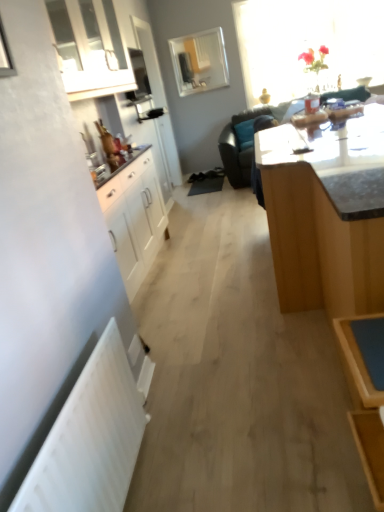
Question: In terms of width, does white matte radiator at lower left look wider or thinner when compared to black leather couch at upper center?

Choices:
 (A) thin
 (B) wide

Answer: (A)

Question: In the image, is white matte radiator at lower left positioned in front of or behind black leather couch at upper center?

Choices:
 (A) behind
 (B) front

Answer: (B)

Question: Estimate the real-world distances between objects in this image. Which object is farther from the translucent glass vase at upper right, marked as the first window in a right-to-left arrangement?

Choices:
 (A) black leather couch at upper center
 (B) white glossy cabinet at upper left
 (C) white matte radiator at lower left
 (D) clear glass mirror at upper center, the first window positioned from the left
 (E) light brown wooden table at center

Answer: (C)

Question: Based on their relative distances, which object is nearer to the black leather couch at upper center?

Choices:
 (A) light brown wooden table at center
 (B) clear glass mirror at upper center, which ranks as the 2th window in right-to-left order
 (C) white matte radiator at lower left
 (D) white glossy cabinet at upper left
 (E) translucent glass vase at upper right, positioned as the 2th window in left-to-right order

Answer: (D)